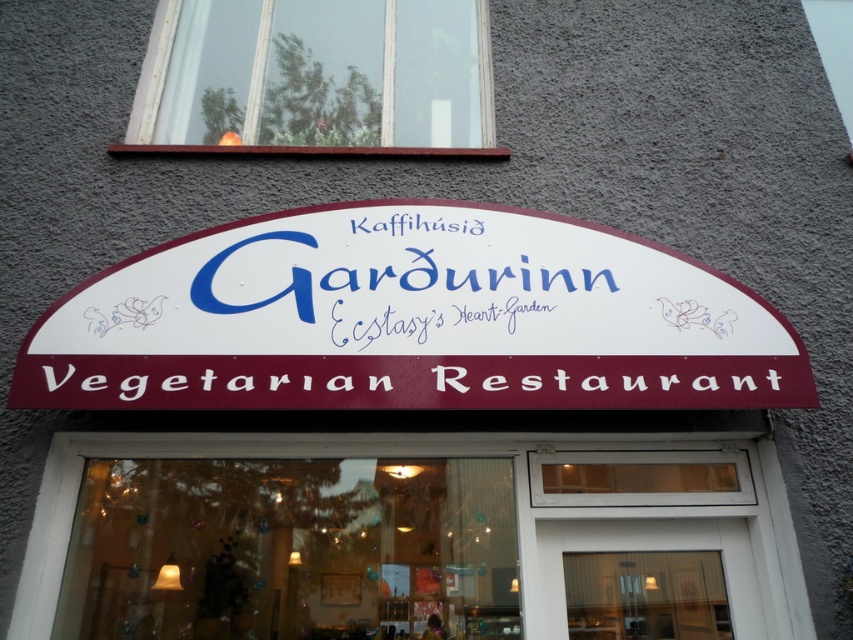
Question: Is white plastic sign at center to the left of white paper sign at center from the viewer's perspective?

Choices:
 (A) no
 (B) yes

Answer: (B)

Question: Does white wood window at upper center appear on the left side of white wooden door at center?

Choices:
 (A) yes
 (B) no

Answer: (A)

Question: Is white wood window at upper center closer to camera compared to white paper sign at center?

Choices:
 (A) no
 (B) yes

Answer: (A)

Question: Which of the following is the farthest from the observer?

Choices:
 (A) white wood window at upper center
 (B) white paper sign at center
 (C) white plastic sign at center
 (D) white wooden door at center

Answer: (A)

Question: Which object is the farthest from the white plastic sign at center?

Choices:
 (A) white paper sign at center
 (B) white wood window at upper center
 (C) white wooden door at center

Answer: (B)

Question: Among these objects, which one is nearest to the camera?

Choices:
 (A) white plastic sign at center
 (B) white paper sign at center
 (C) white wooden door at center

Answer: (A)